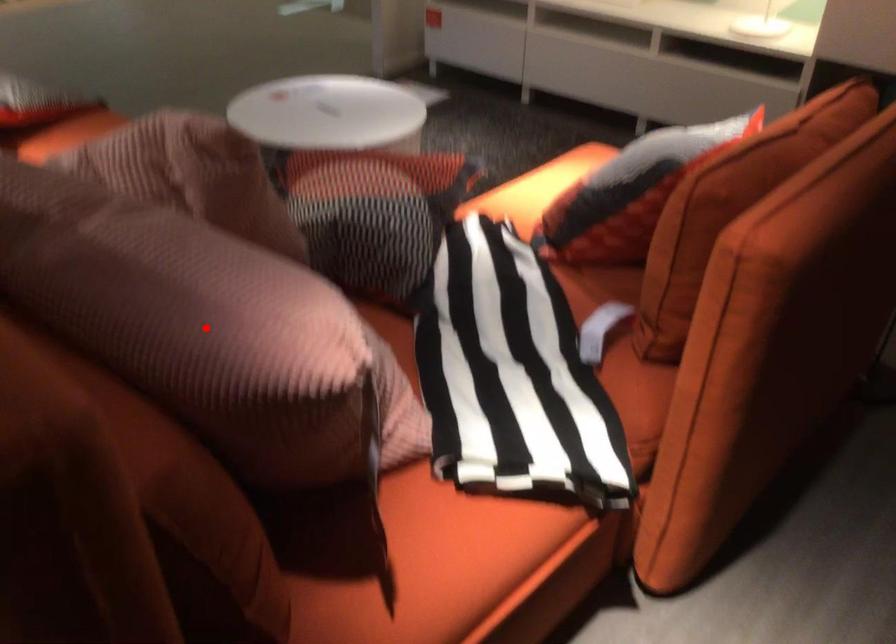
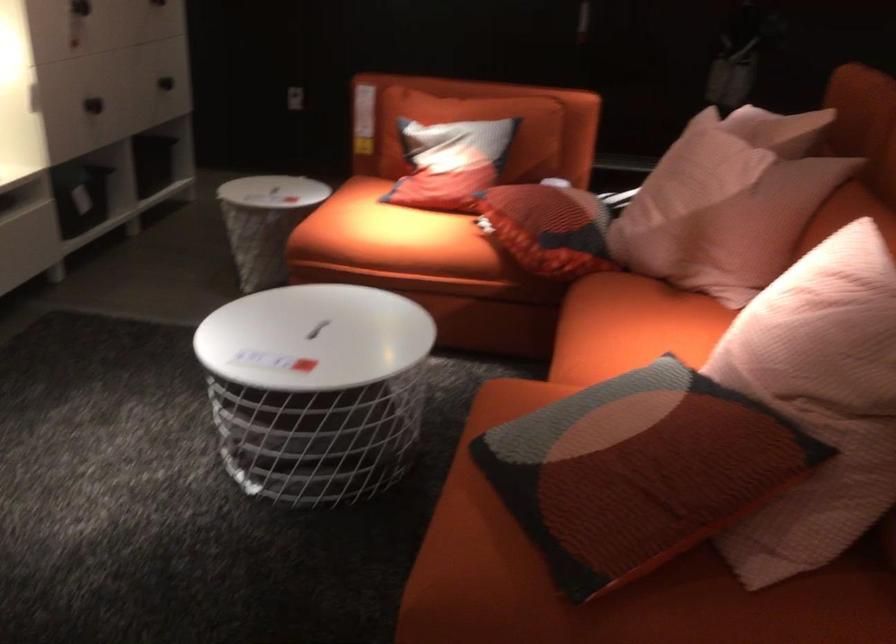
Question: I am providing you with two images of the same scene from different viewpoints. A red point is marked on the first image. Can you still see the location of the red point in image 2?

Choices:
 (A) Yes
 (B) No

Answer: (B)